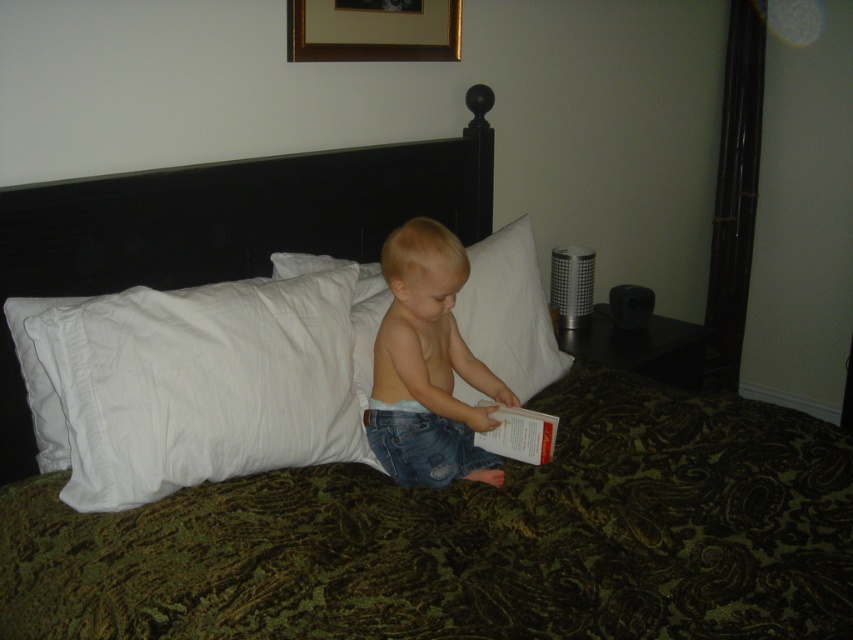
Can you confirm if denim shorts at center is thinner than white paper at center?

Incorrect, denim shorts at center's width is not less than white paper at center's.

Does denim shorts at center appear on the left side of white paper at center?

Correct, you'll find denim shorts at center to the left of white paper at center.

The image size is (853, 640). Describe the element at coordinates (427, 365) in the screenshot. I see `denim shorts at center` at that location.

Find the location of a particular element. Image resolution: width=853 pixels, height=640 pixels. denim shorts at center is located at coordinates (427, 365).

Can you confirm if white cotton pillow at left is positioned above denim shorts at center?

Actually, white cotton pillow at left is below denim shorts at center.

Who is shorter, white cotton pillow at left or denim shorts at center?

Standing shorter between the two is white cotton pillow at left.

Is point (94, 307) in front of point (428, 248)?

That is True.

This screenshot has width=853, height=640. In order to click on white cotton pillow at left in this screenshot , I will do (201, 385).

Measure the distance between black wood headboard at upper center and camera.

A distance of 4.85 feet exists between black wood headboard at upper center and camera.

Does black wood headboard at upper center lie behind white soft pillow at center?

That is False.

Image resolution: width=853 pixels, height=640 pixels. What do you see at coordinates (223, 227) in the screenshot?
I see `black wood headboard at upper center` at bounding box center [223, 227].

The width and height of the screenshot is (853, 640). Find the location of `black wood headboard at upper center`. black wood headboard at upper center is located at coordinates (223, 227).